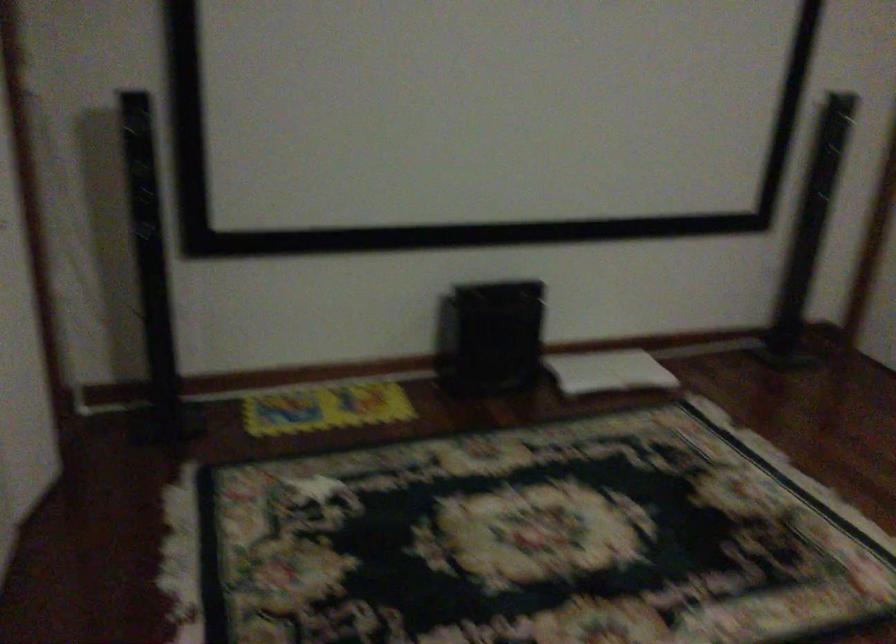
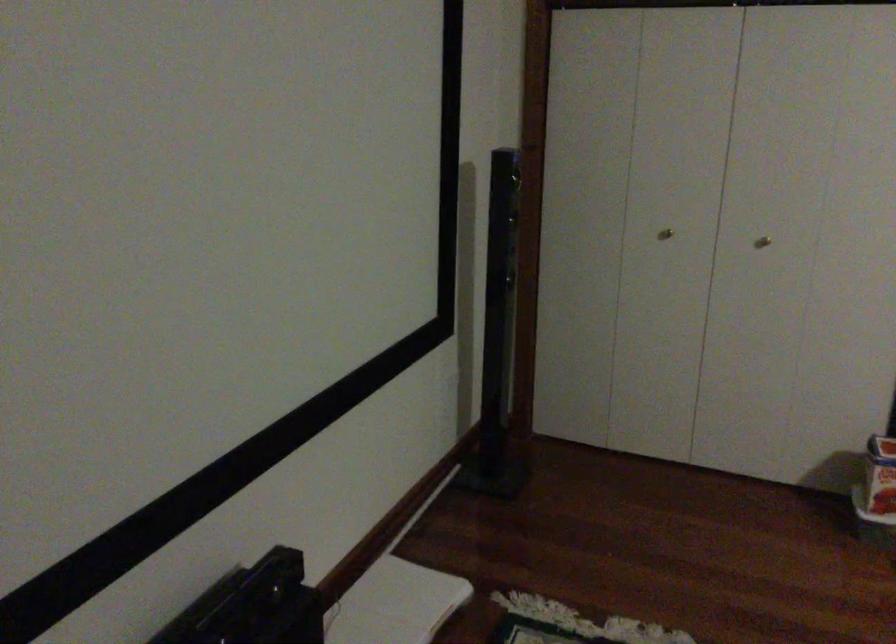
Find the pixel in the second image that matches point 632,363 in the first image.

(394, 603)